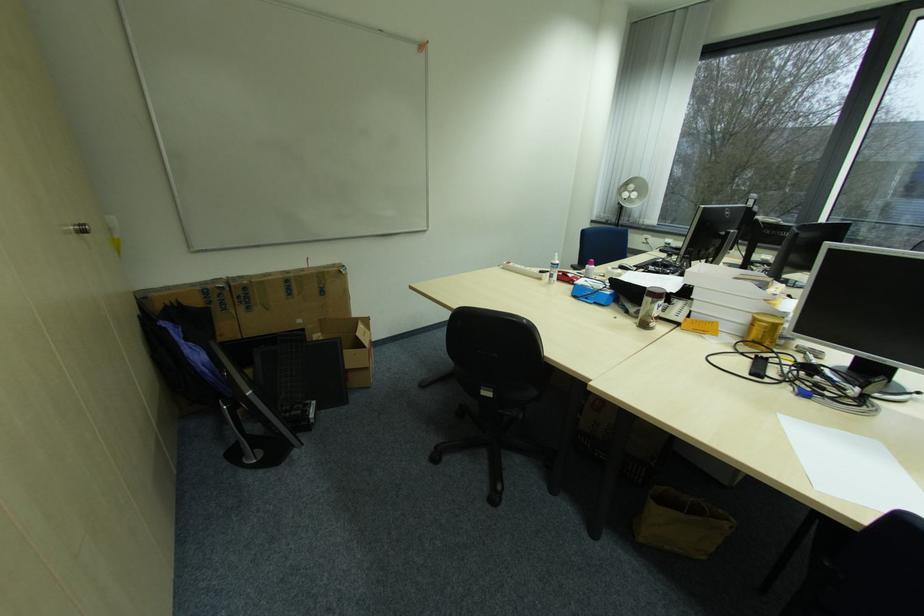
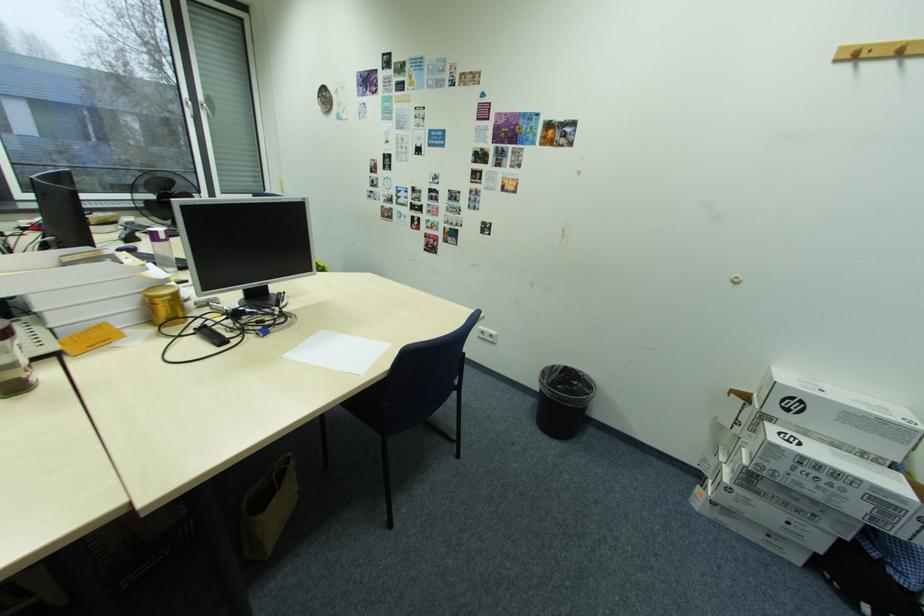
How did the camera likely rotate?

The camera's rotation is toward right-down.